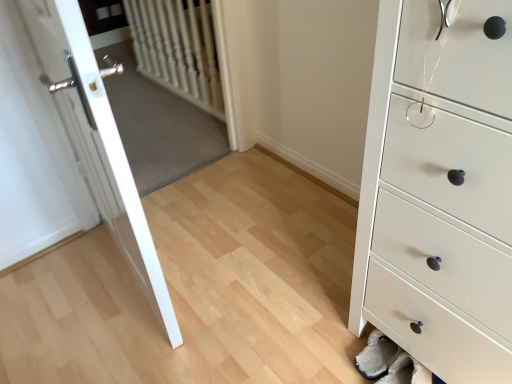
Image resolution: width=512 pixels, height=384 pixels. Identify the location of free point behind white glossy door at left. tap(192, 203).